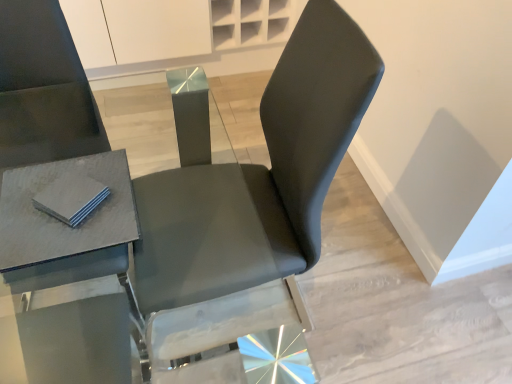
Question: From a real-world perspective, is matte black chair at center physically located above or below gray matte pad at upper left?

Choices:
 (A) above
 (B) below

Answer: (B)

Question: Looking at the image, does matte black chair at center seem bigger or smaller compared to gray matte pad at upper left?

Choices:
 (A) big
 (B) small

Answer: (A)

Question: Estimate the real-world distances between objects in this image. Which object is closer to the matte gray table at left?

Choices:
 (A) matte black chair at center
 (B) gray matte pad at upper left

Answer: (B)

Question: Estimate the real-world distances between objects in this image. Which object is closer to the matte gray table at left?

Choices:
 (A) matte black chair at center
 (B) gray matte pad at upper left

Answer: (B)